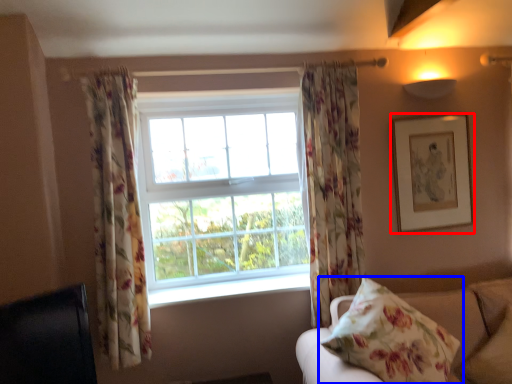
Question: Among these objects, which one is nearest to the camera, picture frame (highlighted by a red box) or pillow (highlighted by a blue box)?

Choices:
 (A) picture frame
 (B) pillow

Answer: (B)